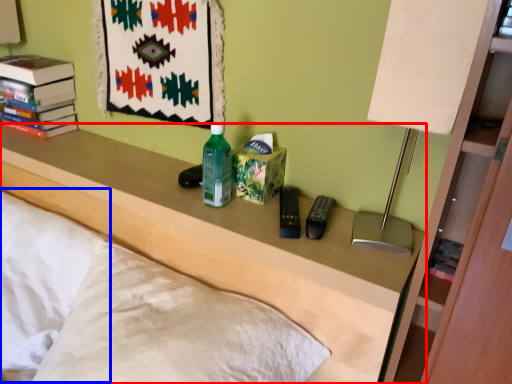
Question: Among these objects, which one is nearest to the camera, furniture (highlighted by a red box) or pillow (highlighted by a blue box)?

Choices:
 (A) furniture
 (B) pillow

Answer: (A)